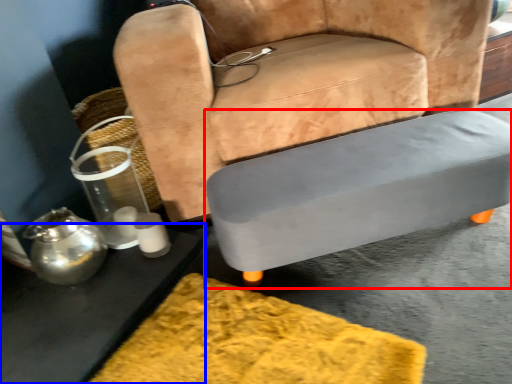
Question: Which point is further to the camera, table (highlighted by a red box) or table (highlighted by a blue box)?

Choices:
 (A) table
 (B) table

Answer: (A)